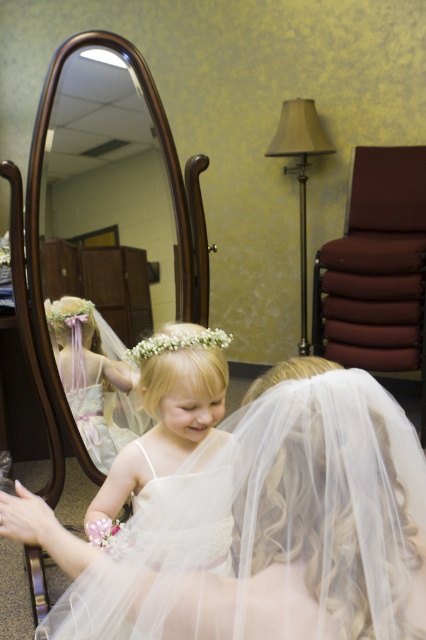
Does white tulle veil at lower center have a lesser width compared to pastel pink tulle dress at center?

No, white tulle veil at lower center is not thinner than pastel pink tulle dress at center.

Between white tulle veil at lower center and pastel pink tulle dress at center, which one has more height?

white tulle veil at lower center is taller.

Is point (383, 572) positioned in front of point (115, 364)?

Yes, it is.

Locate an element on the screen. This screenshot has height=640, width=426. white tulle veil at lower center is located at coordinates (270, 525).

Measure the distance between point (x=92, y=328) and camera.

They are 1.95 meters apart.

Can you confirm if pastel pink tulle dress at center is thinner than white floral crown at center?

In fact, pastel pink tulle dress at center might be wider than white floral crown at center.

The height and width of the screenshot is (640, 426). Find the location of `pastel pink tulle dress at center`. pastel pink tulle dress at center is located at coordinates (91, 374).

Find the location of `pastel pink tulle dress at center`. pastel pink tulle dress at center is located at coordinates (91, 374).

Is point (210, 609) farther from viewer compared to point (117, 584)?

No, (210, 609) is closer to viewer.

Locate an element on the screen. white tulle veil at lower center is located at coordinates pos(270,525).